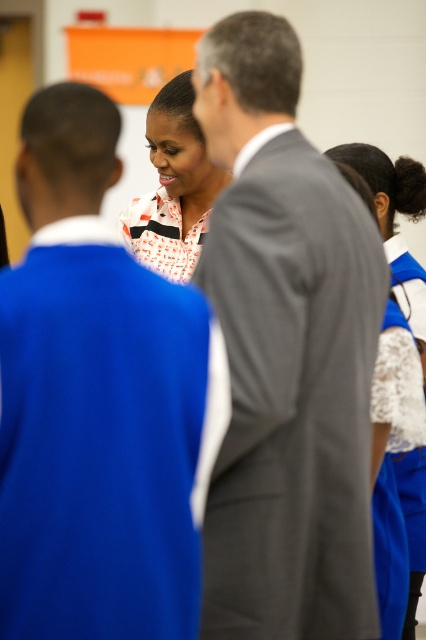
You are attending a gathering and need to identify the clothing items worn by the central figure. Which clothing item is positioned lower on her body between the smooth gray suit at center and the white printed blouse at center?

The smooth gray suit at center is positioned lower on her body than the white printed blouse at center.

Consider the image. You are organizing a small event and need to know if two attendees, the smooth gray suit at center and the white printed blouse at center, can comfortably sit side by side at a table that is 5 feet wide. Can they fit?

The smooth gray suit at center and white printed blouse at center are 4.47 feet apart, so they can comfortably sit side by based on the table width of 5 feet.